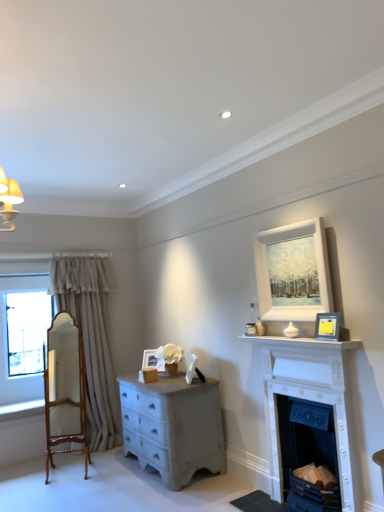
Question: Should I look upward or downward to see beige fabric curtain at left?

Choices:
 (A) up
 (B) down

Answer: (B)

Question: Is black matte picture frame at upper right, positioned as the 2th picture frame in top-to-bottom order, positioned with its back to white painted wood fireplace at lower right, the first fireplace ordered from the bottom?

Choices:
 (A) no
 (B) yes

Answer: (A)

Question: Is black matte picture frame at upper right, the 1th picture frame from the right, next to white painted wood fireplace at lower right, the first fireplace ordered from the bottom, and touching it?

Choices:
 (A) yes
 (B) no

Answer: (B)

Question: From the image's perspective, would you say black matte picture frame at upper right, positioned as the 2th picture frame in top-to-bottom order, is positioned over white painted wood fireplace at lower right, the first fireplace ordered from the bottom?

Choices:
 (A) no
 (B) yes

Answer: (B)

Question: Are black matte picture frame at upper right, the 1th picture frame from the right, and white painted wood fireplace at lower right, the first fireplace ordered from the bottom, located far from each other?

Choices:
 (A) no
 (B) yes

Answer: (A)

Question: Is white painted wood fireplace at lower right, the first fireplace ordered from the bottom, completely or partially inside black matte picture frame at upper right, the 1th picture frame in the front-to-back sequence?

Choices:
 (A) yes
 (B) no

Answer: (B)

Question: From a real-world perspective, is black matte picture frame at upper right, placed as the fourth picture frame when sorted from left to right, physically below white painted wood fireplace at lower right, the first fireplace ordered from the bottom?

Choices:
 (A) yes
 (B) no

Answer: (B)

Question: Would you say white painted wood fireplace at lower right, the first fireplace ordered from the bottom, is outside white painted wood fireplace at right, which is the 2th fireplace in bottom-to-top order?

Choices:
 (A) yes
 (B) no

Answer: (B)

Question: Is white painted wood fireplace at lower right, which ranks as the second fireplace in top-to-bottom order, to the right of white painted wood fireplace at right, which is the 2th fireplace in bottom-to-top order, from the viewer's perspective?

Choices:
 (A) no
 (B) yes

Answer: (B)

Question: From a real-world perspective, is white painted wood fireplace at lower right, which ranks as the second fireplace in top-to-bottom order, on white painted wood fireplace at right, which is the 2th fireplace in bottom-to-top order?

Choices:
 (A) no
 (B) yes

Answer: (A)

Question: Is white painted wood fireplace at lower right, the first fireplace ordered from the bottom, oriented towards white painted wood fireplace at right, which is the 1th fireplace from top to bottom?

Choices:
 (A) no
 (B) yes

Answer: (B)

Question: From the image's perspective, is white painted wood fireplace at lower right, which ranks as the second fireplace in top-to-bottom order, under white painted wood fireplace at right, which is the 2th fireplace in bottom-to-top order?

Choices:
 (A) no
 (B) yes

Answer: (B)

Question: Is white painted wood fireplace at lower right, which ranks as the second fireplace in top-to-bottom order, facing away from white painted wood fireplace at right, which is the 2th fireplace in bottom-to-top order?

Choices:
 (A) no
 (B) yes

Answer: (B)

Question: Is matte white picture frame at center, marked as the 1th picture frame in a left-to-right arrangement, outside of white painted wood fireplace at right, which is the 1th fireplace from top to bottom?

Choices:
 (A) yes
 (B) no

Answer: (A)